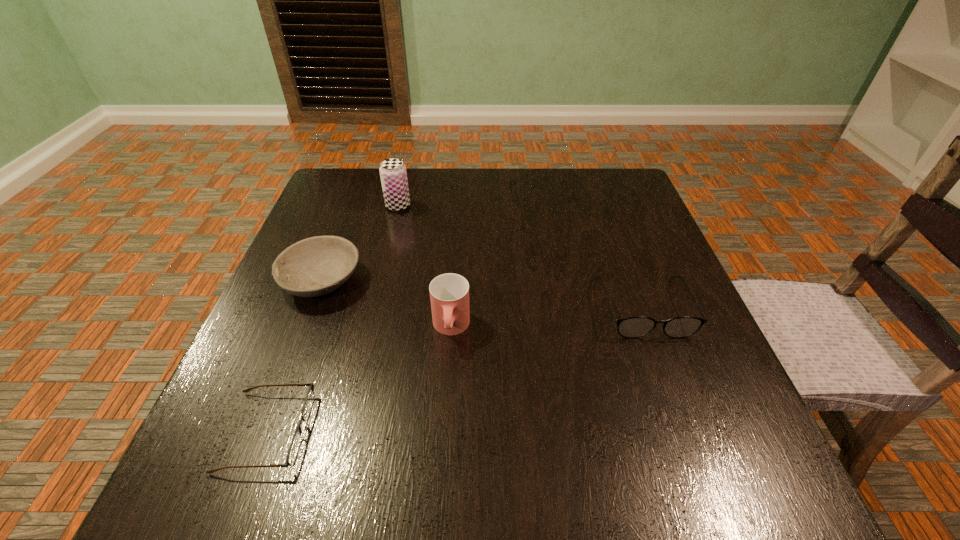
This screenshot has width=960, height=540. In order to click on free space located 0.140m on the side of the fourth shortest object with the handle in this screenshot , I will do `click(445, 421)`.

Identify the location of free space located 0.160m on the front-facing side of the farther spectacles. (684, 419).

Identify the location of vacant point located on the right of the bowl. Image resolution: width=960 pixels, height=540 pixels. click(553, 280).

Image resolution: width=960 pixels, height=540 pixels. Identify the location of free region located on the front-facing side of the shorter spectacles. (436, 431).

The width and height of the screenshot is (960, 540). I want to click on object positioned at the far edge, so click(393, 174).

Where is `object situated at the near edge`? object situated at the near edge is located at coordinates (295, 444).

Locate an element on the screen. bowl that is at the left edge is located at coordinates (315, 266).

Image resolution: width=960 pixels, height=540 pixels. I want to click on spectacles located at the left edge, so click(295, 444).

Where is `object present at the right edge`? The height and width of the screenshot is (540, 960). object present at the right edge is located at coordinates (638, 326).

Find the location of a particular element. The image size is (960, 540). object that is at the near left corner is located at coordinates (295, 444).